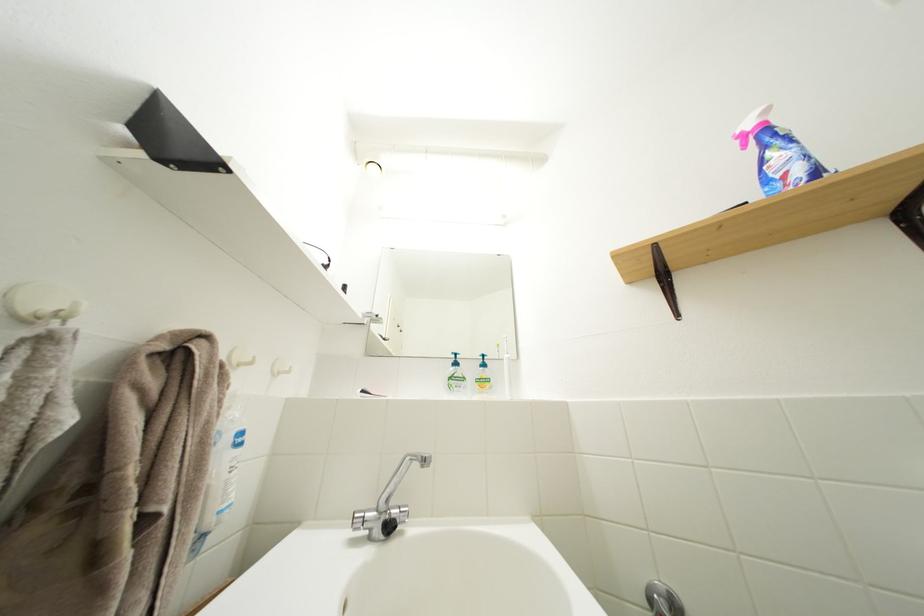
Image resolution: width=924 pixels, height=616 pixels. What do you see at coordinates (457, 384) in the screenshot? I see `the green soap pump` at bounding box center [457, 384].